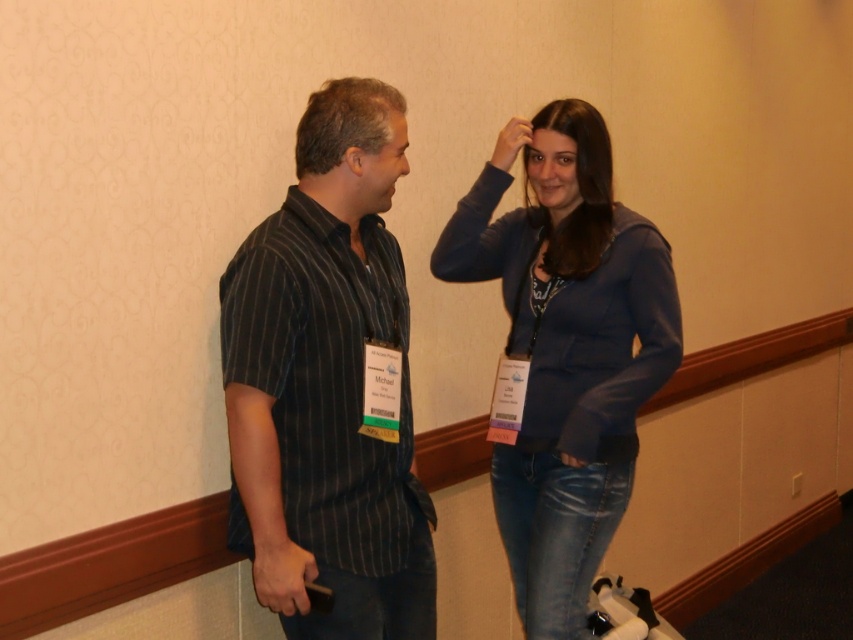
You are a photographer at a networking event. You want to capture a closeup shot of the name tags of both individuals. Looking at the scene, which object is closer to the camera between the matte blue hand at upper center and the matte skin forehead at upper center?

The matte blue hand at upper center is closer to the camera because it has a larger size compared to the matte skin forehead at upper center.

You are standing at the point with coordinates point (496, 152) and want to walk to the point with coordinates point (560, 209). Which direction should you move in to reach your destination?

To reach point (560, 209) from point (496, 152), you should move forward since point (560, 209) is behind point (496, 152).

You are a photographer at the event and want to capture a candid shot of the person whose hand is at point (509, 141). Which person should you focus on?

The point (509, 141) corresponds to the matte blue hand at upper center, which belongs to the woman on the right wearing a blue zip up hoodie over a white top.